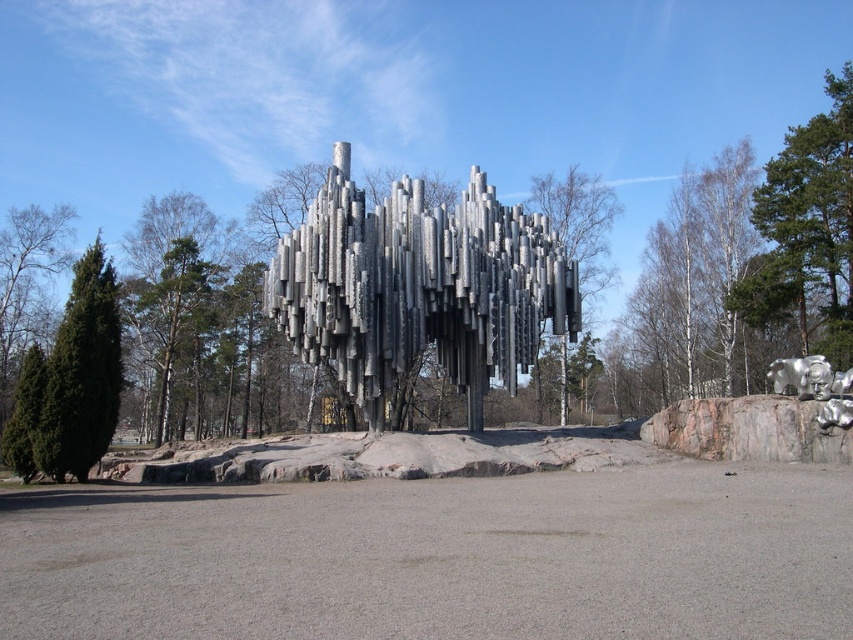
You are an artist planning to photograph the polished metal sculpture at center and the silver metallic bear at center from a distance. Based on their sizes, which one would appear larger in the photo?

The polished metal sculpture at center might be wider than silver metallic bear at center, so it could appear larger in the photo depending on their actual sizes and distances from the camera.

You are an artist planning to photograph the polished metal sculpture at center and the white bark tree at center from a distance. Based on their sizes in the image, which one would appear smaller in your photo?

The polished metal sculpture at center occupies less space than the white bark tree at center, so it would appear smaller in the photo.